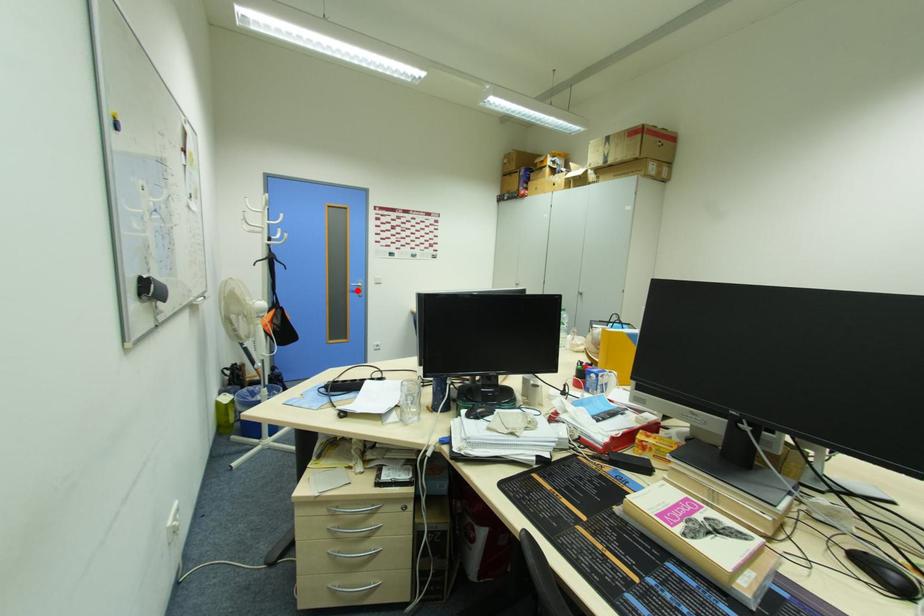
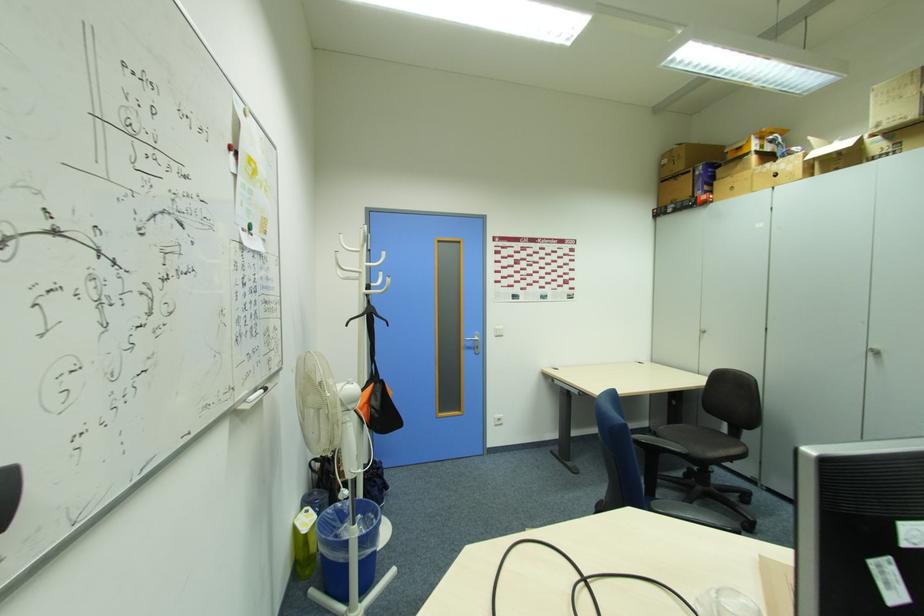
Where in the second image is the point corresponding to the highlighted location from the first image?

(472, 346)